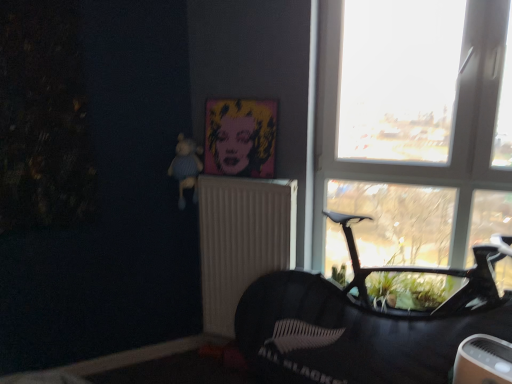
What do you see at coordinates (240, 137) in the screenshot? This screenshot has height=384, width=512. I see `pop art canvas at upper center` at bounding box center [240, 137].

Describe the element at coordinates (242, 240) in the screenshot. I see `white textured radiator at center` at that location.

I want to click on blue knitted bear at upper left, so click(x=186, y=167).

You are a GUI agent. You are given a task and a screenshot of the screen. Output one action in this format:
    pyautogui.click(x=<x>, y=<y>)
    Task: Click on the pop art canvas at upper center
    The height and width of the screenshot is (384, 512).
    Given the screenshot: What is the action you would take?
    pyautogui.click(x=240, y=137)

Is transparent glass window at upper right behind white textured radiator at center?

That is False.

Who is bigger, transparent glass window at upper right or white textured radiator at center?

Bigger between the two is transparent glass window at upper right.

Is transparent glass window at upper right aimed at white textured radiator at center?

No, transparent glass window at upper right is not facing towards white textured radiator at center.

Measure the distance from transparent glass window at upper right to white textured radiator at center.

The distance of transparent glass window at upper right from white textured radiator at center is 56.70 centimeters.

Which of these two, pop art canvas at upper center or blue knitted bear at upper left, is smaller?

Smaller between the two is blue knitted bear at upper left.

Between pop art canvas at upper center and blue knitted bear at upper left, which one has more height?

pop art canvas at upper center.

Can blue knitted bear at upper left be found inside pop art canvas at upper center?

No, blue knitted bear at upper left is not inside pop art canvas at upper center.

From the picture: From a real-world perspective, is pop art canvas at upper center above or below transparent glass window at upper right?

pop art canvas at upper center is above transparent glass window at upper right.

Is pop art canvas at upper center taller than transparent glass window at upper right?

No, pop art canvas at upper center is not taller than transparent glass window at upper right.

Is pop art canvas at upper center turned away from transparent glass window at upper right?

No, pop art canvas at upper center is not facing the opposite direction of transparent glass window at upper right.

Considering their positions, is pop art canvas at upper center located in front of or behind white textured radiator at center?

pop art canvas at upper center is positioned closer to the viewer than white textured radiator at center.

In order to click on radiator behind the pop art canvas at upper center in this screenshot , I will do `click(242, 240)`.

Is point (220, 132) positioned after point (234, 182)?

Yes, point (220, 132) is farther from viewer.

Does pop art canvas at upper center have a greater width compared to white textured radiator at center?

No.

Does transparent glass window at upper right appear on the left side of blue knitted bear at upper left?

No.

Would you consider transparent glass window at upper right to be distant from blue knitted bear at upper left?

Indeed, transparent glass window at upper right is not near blue knitted bear at upper left.

Considering the sizes of objects transparent glass window at upper right and blue knitted bear at upper left in the image provided, who is thinner, transparent glass window at upper right or blue knitted bear at upper left?

transparent glass window at upper right.

Who is shorter, white textured radiator at center or pop art canvas at upper center?

pop art canvas at upper center is shorter.

Does white textured radiator at center lie behind pop art canvas at upper center?

That is True.

Identify the location of radiator below the pop art canvas at upper center (from the image's perspective). (242, 240).

Is white textured radiator at center with pop art canvas at upper center?

No.

Is blue knitted bear at upper left wider than white textured radiator at center?

Indeed, blue knitted bear at upper left has a greater width compared to white textured radiator at center.

Considering the positions of objects blue knitted bear at upper left and white textured radiator at center in the image provided, who is behind, blue knitted bear at upper left or white textured radiator at center?

blue knitted bear at upper left is further away from the camera.

Consider the image. Is blue knitted bear at upper left facing towards white textured radiator at center?

No, blue knitted bear at upper left is not facing towards white textured radiator at center.

Can you confirm if blue knitted bear at upper left is shorter than white textured radiator at center?

Yes, blue knitted bear at upper left is shorter than white textured radiator at center.

Find the location of `radiator that is below the transparent glass window at upper right (from the image's perspective)`. radiator that is below the transparent glass window at upper right (from the image's perspective) is located at coordinates (242, 240).

This screenshot has height=384, width=512. In order to click on toy located behind the pop art canvas at upper center in this screenshot , I will do `click(186, 167)`.

When comparing their distances from transparent glass window at upper right, does blue knitted bear at upper left or pop art canvas at upper center seem closer?

Based on the image, pop art canvas at upper center appears to be nearer to transparent glass window at upper right.

From the image, which object appears to be nearer to blue knitted bear at upper left, pop art canvas at upper center or transparent glass window at upper right?

pop art canvas at upper center is positioned closer to the anchor blue knitted bear at upper left.

When comparing their distances from white textured radiator at center, does transparent glass window at upper right or pop art canvas at upper center seem further?

Among the two, transparent glass window at upper right is located further to white textured radiator at center.

Which object lies nearer to the anchor point pop art canvas at upper center, blue knitted bear at upper left or transparent glass window at upper right?

Based on the image, blue knitted bear at upper left appears to be nearer to pop art canvas at upper center.

Which object lies further to the anchor point transparent glass window at upper right, blue knitted bear at upper left or white textured radiator at center?

blue knitted bear at upper left lies further to transparent glass window at upper right than the other object.

Which object lies nearer to the anchor point blue knitted bear at upper left, white textured radiator at center or pop art canvas at upper center?

The object closer to blue knitted bear at upper left is pop art canvas at upper center.

Which object lies nearer to the anchor point white textured radiator at center, blue knitted bear at upper left or pop art canvas at upper center?

Among the two, pop art canvas at upper center is located nearer to white textured radiator at center.

Based on their spatial positions, is white textured radiator at center or blue knitted bear at upper left further from transparent glass window at upper right?

Based on the image, blue knitted bear at upper left appears to be further to transparent glass window at upper right.

Image resolution: width=512 pixels, height=384 pixels. In order to click on radiator between blue knitted bear at upper left and transparent glass window at upper right in the horizontal direction in this screenshot , I will do `click(242, 240)`.

This screenshot has height=384, width=512. I want to click on radiator between pop art canvas at upper center and transparent glass window at upper right, so click(242, 240).

I want to click on toy between pop art canvas at upper center and white textured radiator at center in the up-down direction, so click(x=186, y=167).

This screenshot has height=384, width=512. What are the coordinates of `picture frame between blue knitted bear at upper left and transparent glass window at upper right` in the screenshot? It's located at (240, 137).